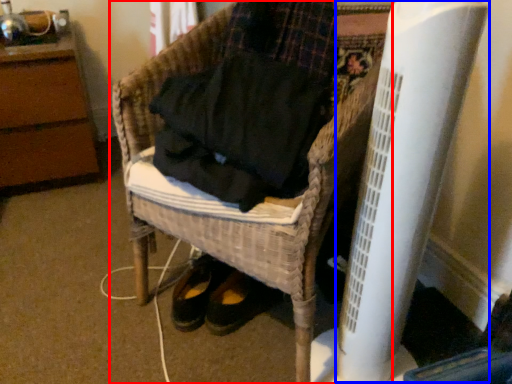
Question: Which of the following is the farthest to the observer, furniture (highlighted by a red box) or radiator (highlighted by a blue box)?

Choices:
 (A) furniture
 (B) radiator

Answer: (A)